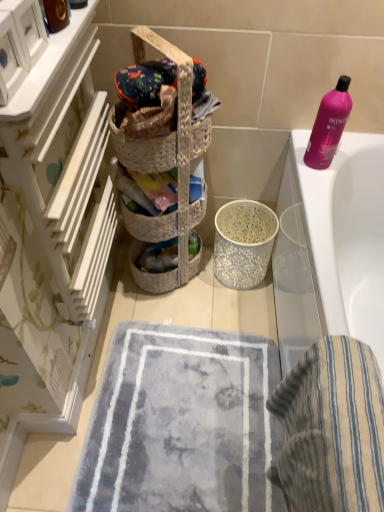
I want to click on vacant area on top of soft gray carpet at center (from a real-world perspective), so click(193, 406).